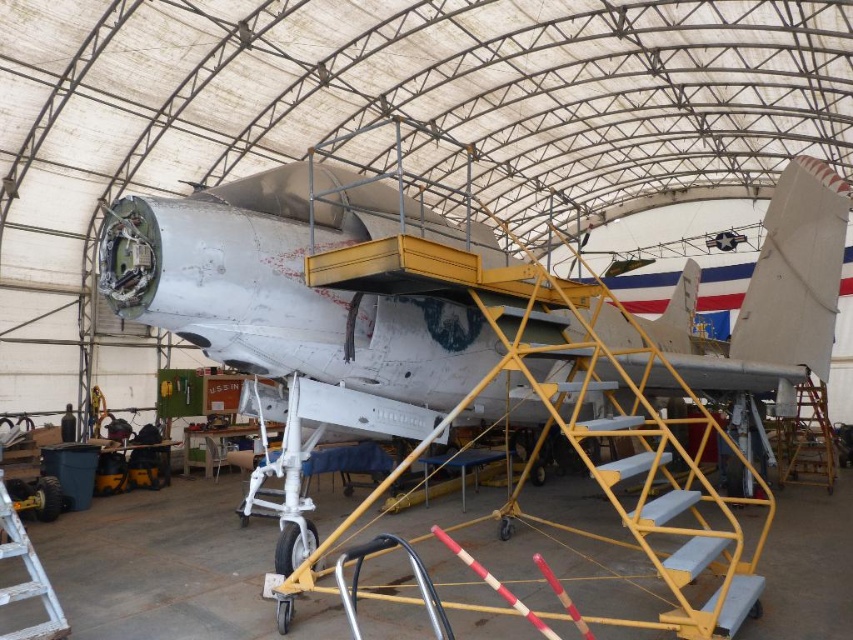
Question: Is yellow metallic staircase at center smaller than yellow metallic ladder at center?

Choices:
 (A) no
 (B) yes

Answer: (B)

Question: Which of the following is the closest to the observer?

Choices:
 (A) (778, 436)
 (B) (0, 557)

Answer: (B)

Question: Which of these objects is positioned farthest from the yellow metallic ladder at center?

Choices:
 (A) white wooden ladder at lower left
 (B) yellow metallic staircase at center

Answer: (A)

Question: Does yellow metallic staircase at center appear on the left side of white wooden ladder at lower left?

Choices:
 (A) no
 (B) yes

Answer: (A)

Question: Which object is closer to the camera taking this photo?

Choices:
 (A) yellow metallic staircase at center
 (B) white wooden ladder at lower left
 (C) yellow metallic ladder at center

Answer: (B)

Question: Is yellow metallic staircase at center smaller than white wooden ladder at lower left?

Choices:
 (A) yes
 (B) no

Answer: (A)